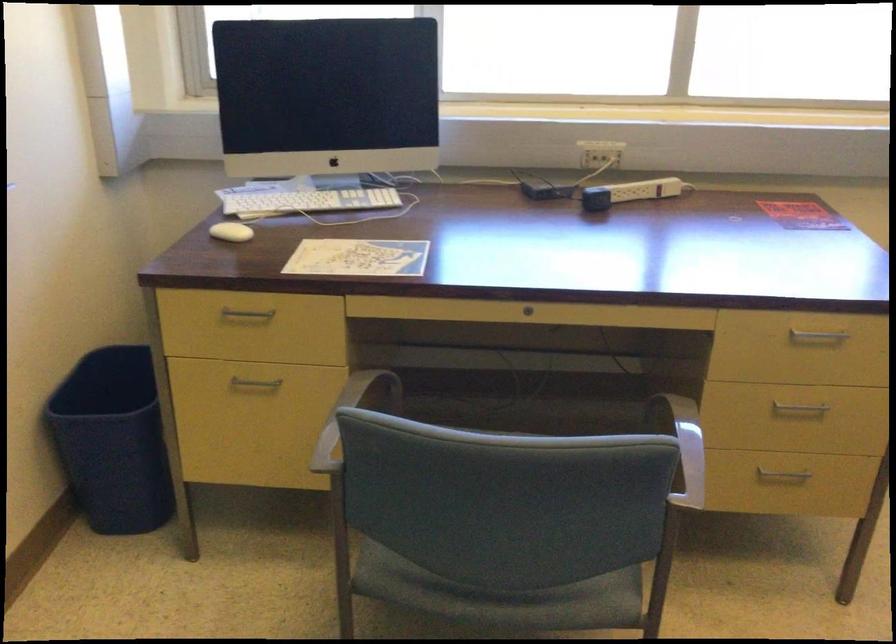
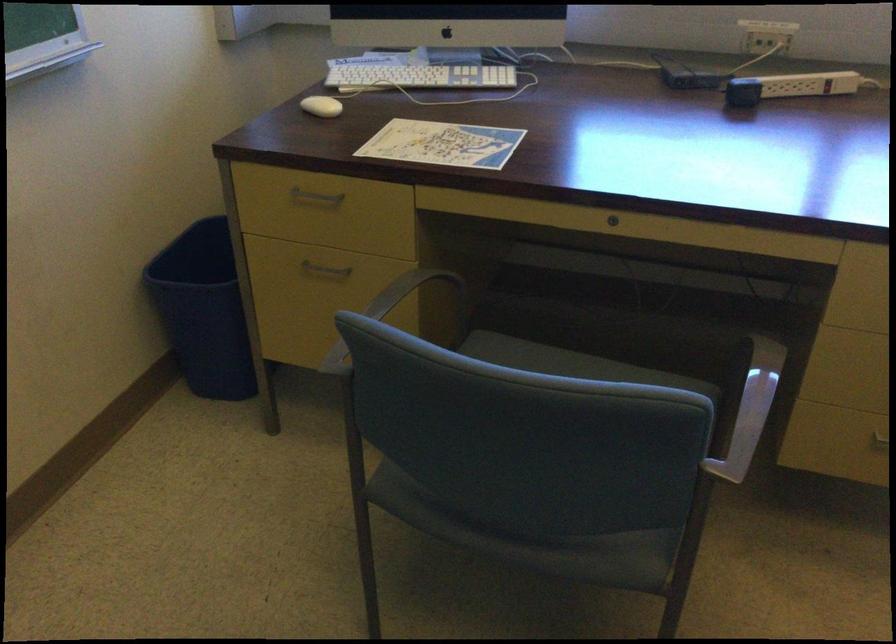
The point at [236,232] is marked in the first image. Where is the corresponding point in the second image?

(321, 106)